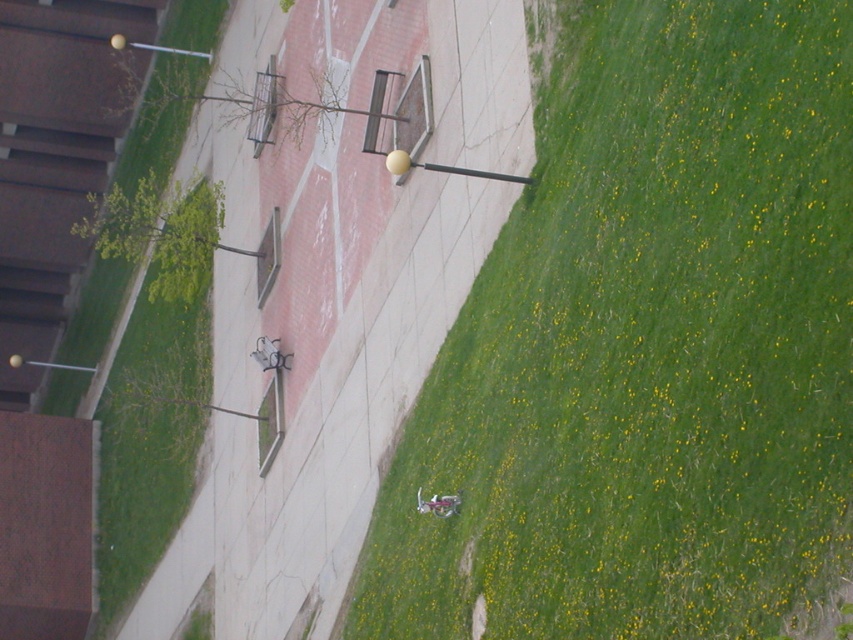
You are standing at the center of the walkway in the outdoor scene. Looking towards the lower right corner of the image, can you see the green grassy at lower right? If yes, what are its coordinates?

Yes, the green grassy at lower right is located at coordinates point [646,348].

Looking at this image, you are standing at the entrance of the campus and see the green grassy at left and the pink matte motorcycle at lower center. Which object occupies more space in the image?

The green grassy at left occupies more space in the image compared to the pink matte motorcycle at lower center as it has a larger size.